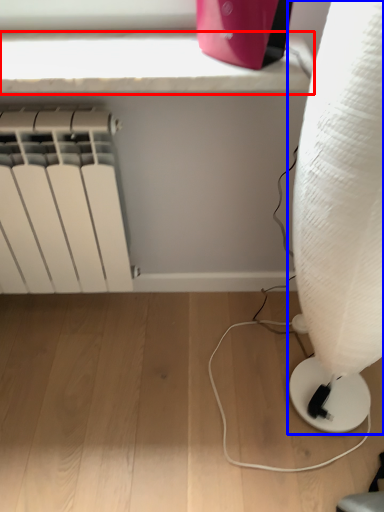
Question: Among these objects, which one is farthest to the camera, window sill (highlighted by a red box) or lamp (highlighted by a blue box)?

Choices:
 (A) window sill
 (B) lamp

Answer: (A)